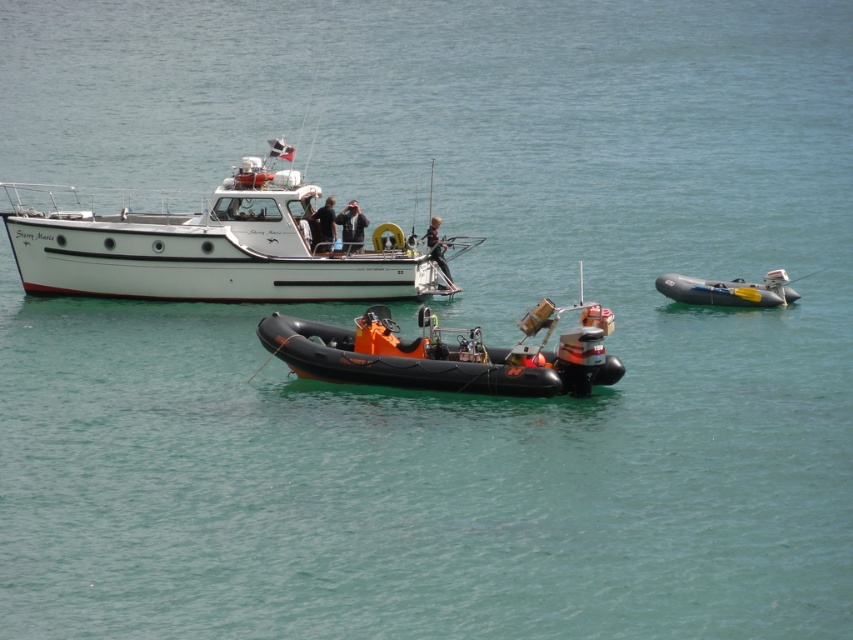
You are a sailor trying to navigate between the white matte boat at upper center and the black rubber dinghy at center. Which boat should you avoid to stay in the clear path?

The black rubber dinghy at center is behind the white matte boat at upper center, so to stay in the clear path, you should avoid the black rubber dinghy at center as it is positioned behind the white matte boat at upper center.

You are a passenger on the rubber inflatable boat at right and want to hand a jacket to someone wearing the black fabric jacket at upper center. Can you reach them directly without moving the boat?

The rubber inflatable boat at right is in front of the black fabric jacket at upper center, meaning the jacket wearer is behind the inflatable boat from your perspective. You cannot reach them directly without moving the boat.